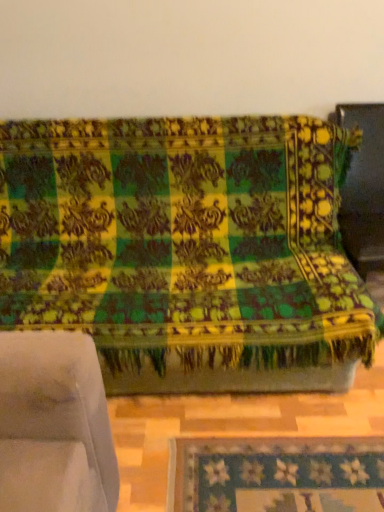
Locate an element on the screen. This screenshot has width=384, height=512. textured green and yellow fabric couch at center is located at coordinates (187, 250).

The image size is (384, 512). Describe the element at coordinates (187, 250) in the screenshot. I see `textured green and yellow fabric couch at center` at that location.

Identify the location of textured green and yellow fabric couch at center. This screenshot has height=512, width=384. click(x=187, y=250).